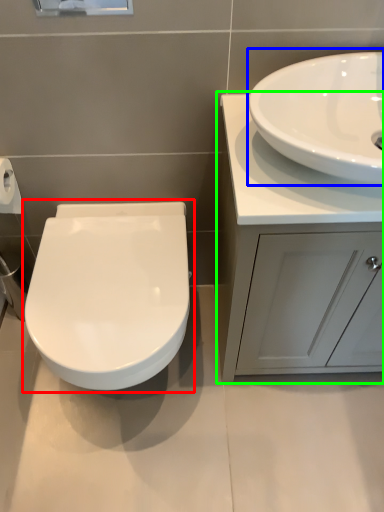
Question: Estimate the real-world distances between objects in this image. Which object is farther from toilet (highlighted by a red box), sink (highlighted by a blue box) or bathroom cabinet (highlighted by a green box)?

Choices:
 (A) sink
 (B) bathroom cabinet

Answer: (A)